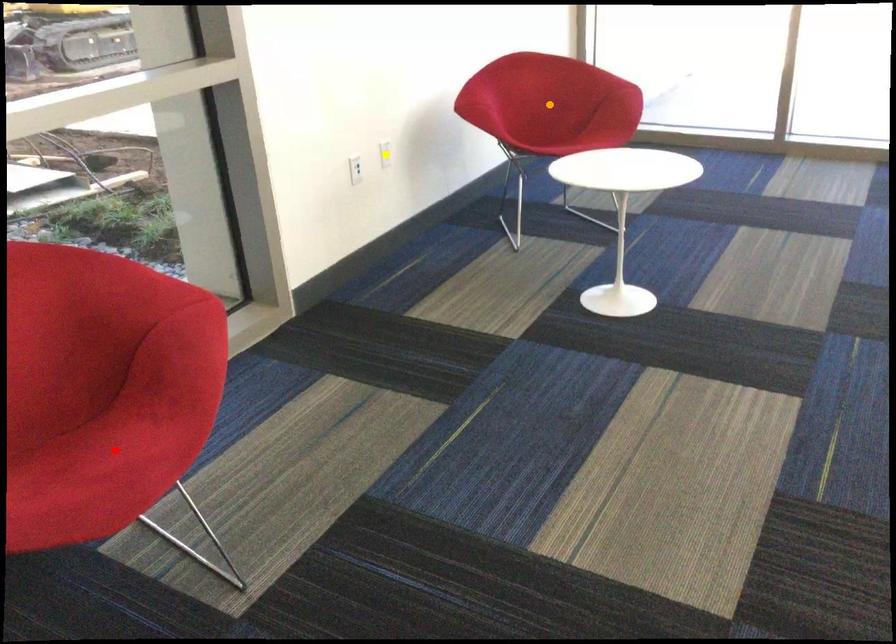
Order these from farthest to nearest:
- orange point
- yellow point
- red point

1. yellow point
2. orange point
3. red point